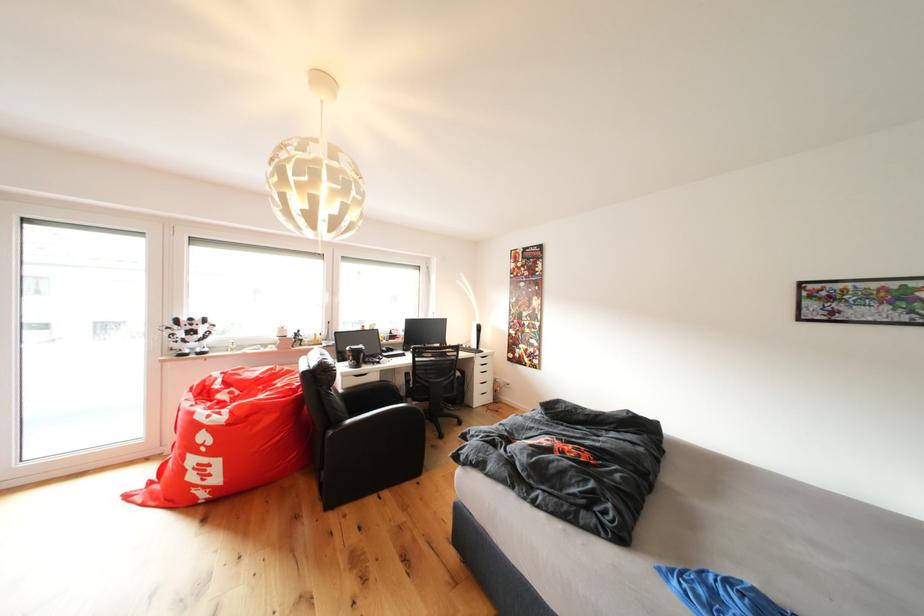
The location [188,334] corresponds to which object?

It corresponds to the white robot figure in the image.